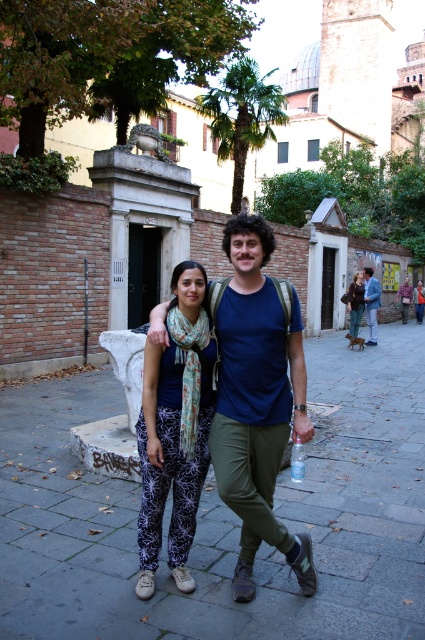
Question: Which is farther from the blue cotton t-shirt at center?

Choices:
 (A) printed fabric pants at center
 (B) gray concrete pavement at center
 (C) matte blue shirt at center
 (D) leather jacket at center

Answer: (C)

Question: Among these points, which one is nearest to the camera?

Choices:
 (A) (356, 275)
 (B) (266, 243)
 (C) (365, 305)

Answer: (B)

Question: Can you confirm if printed fabric pants at center is bigger than transparent plastic bottle at center?

Choices:
 (A) no
 (B) yes

Answer: (B)

Question: Among these objects, which one is nearest to the camera?

Choices:
 (A) matte blue shirt at center
 (B) transparent plastic bottle at center

Answer: (B)

Question: Does printed fabric pants at center appear under transparent plastic bottle at center?

Choices:
 (A) no
 (B) yes

Answer: (A)

Question: Is blue cotton t-shirt at center to the left of leather jacket at center from the viewer's perspective?

Choices:
 (A) no
 (B) yes

Answer: (B)